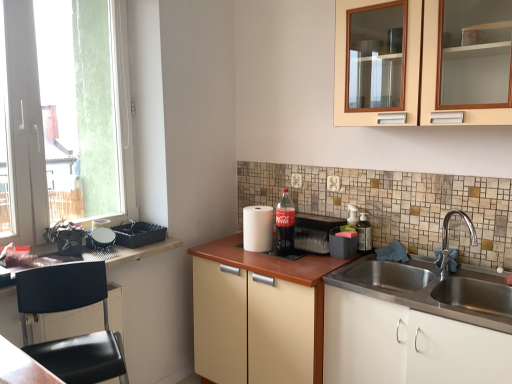
Question: From the image's perspective, relative to matte plastic soda at center, which is the 2th appliance in right-to-left order, is black plastic chair at lower left, which is the 2th cabinetry from top to bottom, above or below?

Choices:
 (A) below
 (B) above

Answer: (A)

Question: Is black plastic chair at lower left, which is the 2th cabinetry from top to bottom, wider or thinner than matte plastic soda at center, which is the 2th appliance in right-to-left order?

Choices:
 (A) wide
 (B) thin

Answer: (A)

Question: Based on their relative distances, which object is nearer to the translucent plastic soap dispenser at right, marked as the second bottle in a left-to-right arrangement?

Choices:
 (A) coca-cola bottle at center, the second bottle positioned from the right
 (B) black plastic chair at lower left, which is the 2th cabinetry from top to bottom
 (C) white matte cabinet at lower right, the fourth cabinetry positioned from the top
 (D) black plastic tray at left, positioned as the 4th appliance in right-to-left order
 (E) wooden countertop at left

Answer: (A)

Question: Which of these objects is positioned farthest from the coca-cola bottle at center, the 1th bottle positioned from the left?

Choices:
 (A) black plastic chair at lower left, the third cabinetry in the bottom-to-top sequence
 (B) beige wood cabinet at center, positioned as the second cabinetry in bottom-to-top order
 (C) matte black tissue box at center, which is counted as the 1th appliance, starting from the right
 (D) translucent plastic soap dispenser at right, marked as the second bottle in a left-to-right arrangement
 (E) transparent glass window at left

Answer: (E)